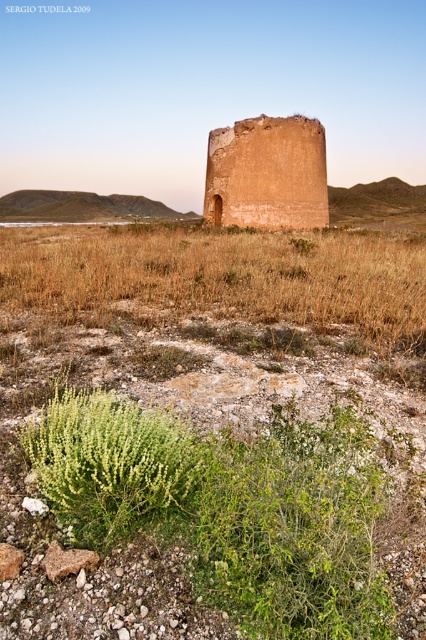
Is green leafy bush at lower left below earthy clay tower at center?

Result: Yes, green leafy bush at lower left is below earthy clay tower at center.

Between point (146, 460) and point (262, 211), which one is positioned in front?

Positioned in front is point (146, 460).

Does point (91, 413) come closer to viewer compared to point (218, 160)?

Yes.

At what (x,y) coordinates should I click in order to perform the action: click on green leafy bush at lower left. Please return your answer as a coordinate pair (x, y). Looking at the image, I should click on (111, 465).